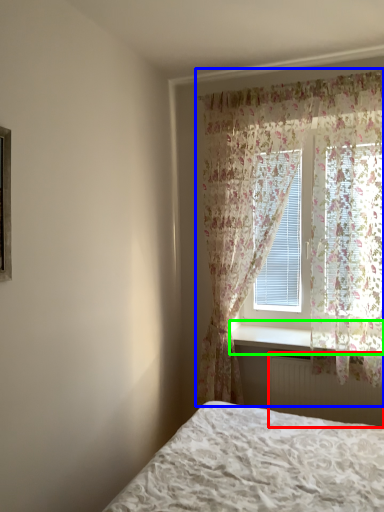
Question: Considering the real-world distances, which object is closest to radiator (highlighted by a red box)? curtain (highlighted by a blue box) or window sill (highlighted by a green box).

Choices:
 (A) curtain
 (B) window sill

Answer: (B)